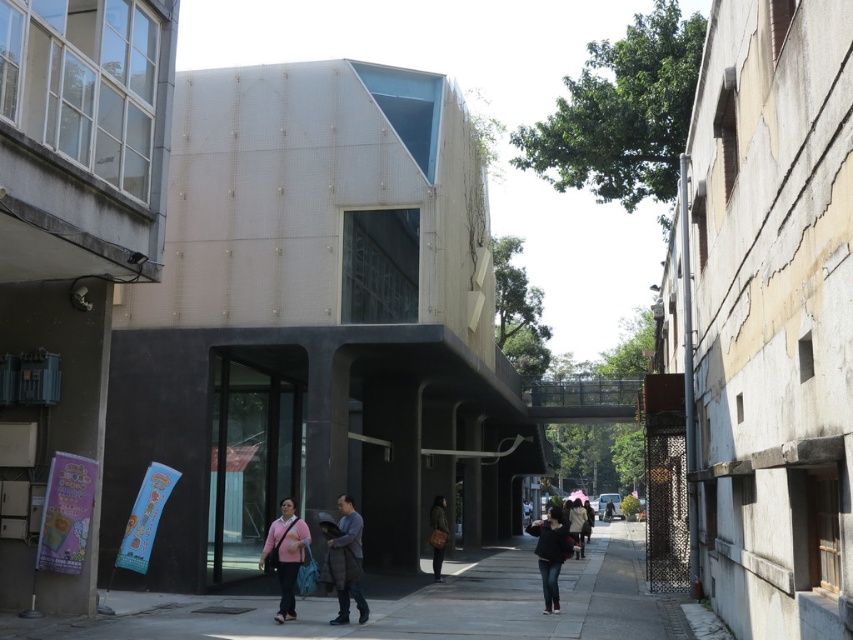
You are a delivery person standing on the walkway in the urban scene. You need to place a pink matte sweater at center and a black matte jacket at center on a shelf that is 5 meters long. Can both items fit on the shelf without overlapping?

The pink matte sweater at center is 5.19 meters from the black matte jacket at center, which means the total required space is 5.19 meters. Since the shelf is only 5 meters long, the items cannot fit without overlapping.

You are standing on the walkway in front of the modern building. You see a pink matte sweater at center and a black matte jacket at center. Which item is nearer to you?

The pink matte sweater at center is closer to the viewer than the black matte jacket at center, so the pink matte sweater at center is nearer to you.